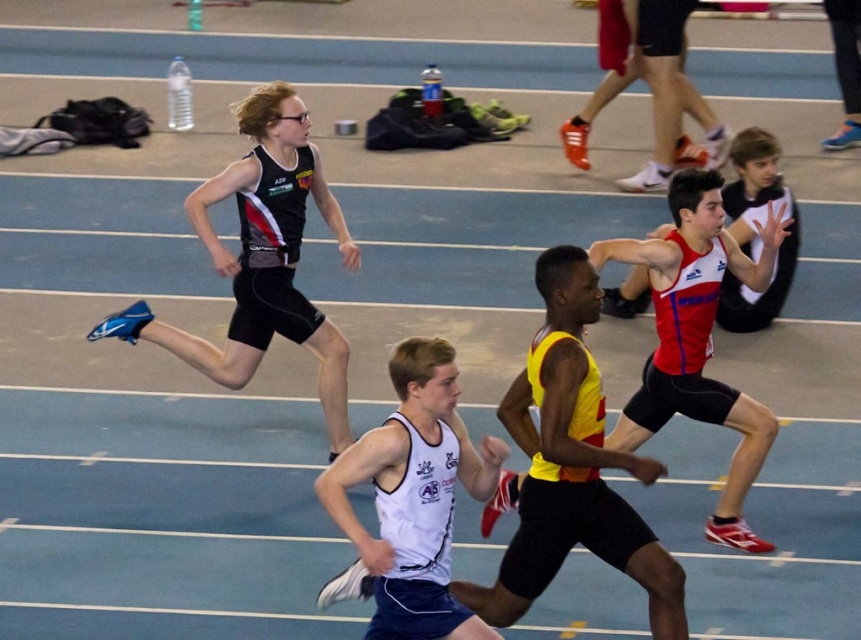
You are a photographer at the indoor track and field event. You want to capture a photo where the matte black singlet at upper left and the white matte tank top at center are both clearly visible. Considering their heights, which one might appear larger in the photo?

The matte black singlet at upper left has a greater height compared to the white matte tank top at center, so it would appear larger in the photo.

You are a photographer at the track and field event. You want to capture a photo of the white matte tank top at center without any other athletes blocking it. Can you adjust your camera angle to avoid the matte black singlet at upper left?

The matte black singlet at upper left is positioned over the white matte tank top at center, so adjusting the camera angle downward might allow you to capture the white matte tank top at center without the matte black singlet at upper left blocking it.